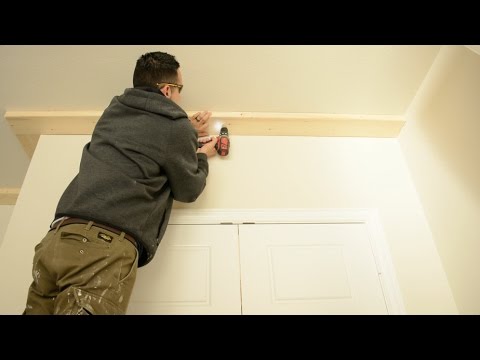
Find the location of a particular element. wall is located at coordinates (278, 167).